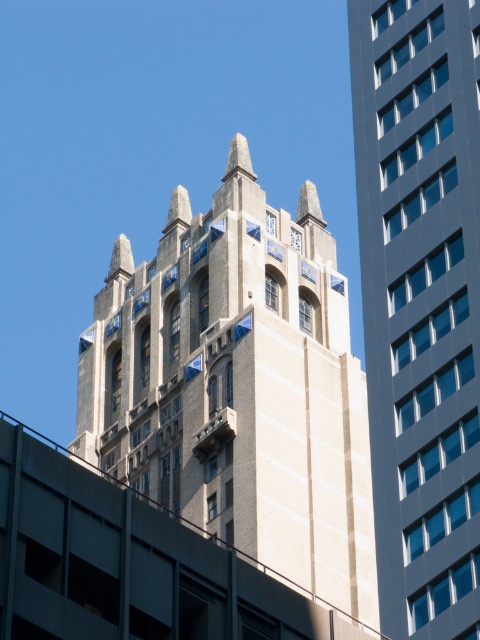
From the picture: Can you confirm if beige stone tower at center is positioned to the left of smooth gray building at center?

Yes, beige stone tower at center is to the left of smooth gray building at center.

Is point (300, 362) positioned behind point (460, 540)?

Yes, point (300, 362) is behind point (460, 540).

Does point (91, 422) come behind point (466, 67)?

That is True.

Where is `beige stone tower at center`? This screenshot has width=480, height=640. beige stone tower at center is located at coordinates (239, 385).